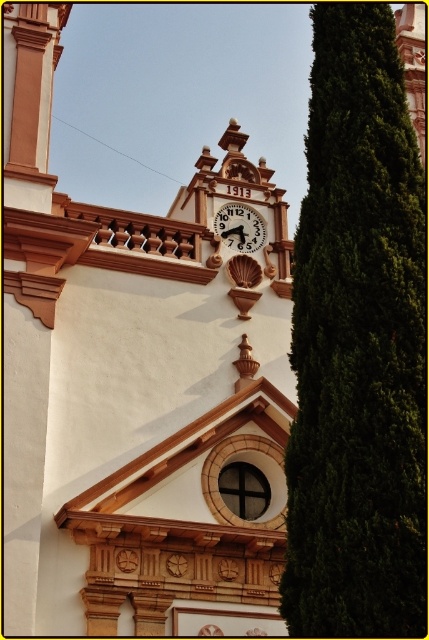
Is point (338, 356) farther from viewer compared to point (244, 214)?

No.

Does green leafy tree at right have a smaller size compared to wooden clock at center?

No, green leafy tree at right is not smaller than wooden clock at center.

You are a GUI agent. You are given a task and a screenshot of the screen. Output one action in this format:
    pyautogui.click(x=<x>, y=<y>)
    Task: Click on the green leafy tree at right
    The height and width of the screenshot is (640, 429).
    Given the screenshot: What is the action you would take?
    pyautogui.click(x=357, y=344)

Image resolution: width=429 pixels, height=640 pixels. What are the coordinates of `green leafy tree at right` in the screenshot? It's located at (357, 344).

Consider the image. Can you confirm if white stone clock at upper center is positioned to the right of green leafy tree at right?

Incorrect, white stone clock at upper center is not on the right side of green leafy tree at right.

Is point (48, 429) farther from viewer compared to point (359, 468)?

Yes.

The height and width of the screenshot is (640, 429). In order to click on white stone clock at upper center in this screenshot , I will do `click(138, 387)`.

Can you confirm if white stone clock at upper center is positioned below wooden clock at center?

Correct, white stone clock at upper center is located below wooden clock at center.

Between point (27, 541) and point (256, 216), which one is positioned behind?

The point (256, 216) is more distant.

Is point (79, 339) positioned before point (239, 225)?

Yes, point (79, 339) is in front of point (239, 225).

The width and height of the screenshot is (429, 640). I want to click on white stone clock at upper center, so click(138, 387).